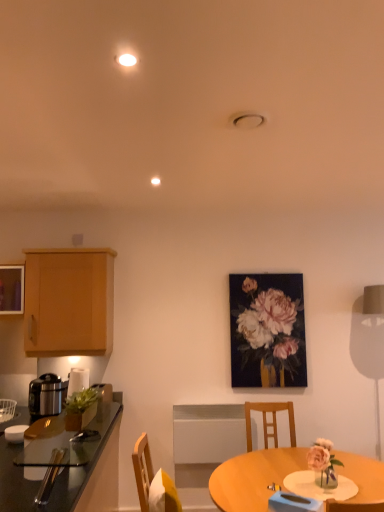
Question: In terms of height, does light wood table at center look taller or shorter compared to metallic silver rice cooker at left?

Choices:
 (A) tall
 (B) short

Answer: (A)

Question: Based on their sizes in the image, would you say light wood table at center is bigger or smaller than metallic silver rice cooker at left?

Choices:
 (A) small
 (B) big

Answer: (B)

Question: Considering the real-world distances, which object is farthest from the light brown wood cabinet at left?

Choices:
 (A) shiny black countertop at left
 (B) metallic silver rice cooker at left
 (C) light wood table at center
 (D) matte black table lamp at right
 (E) metallic gold picture frame at center

Answer: (D)

Question: Estimate the real-world distances between objects in this image. Which object is farther from the light brown wood cabinet at left?

Choices:
 (A) light wood table at center
 (B) metallic gold picture frame at center
 (C) metallic silver rice cooker at left
 (D) shiny black countertop at left
 (E) matte black table lamp at right

Answer: (E)